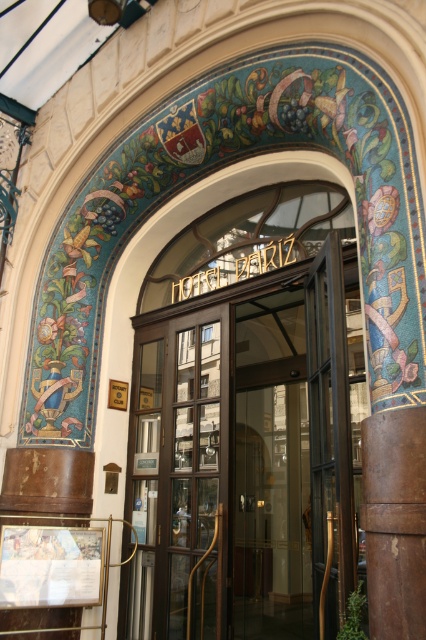
You are a hotel guest standing at the entrance of Hotel Bariz. You need to determine which object is taller between the polished brass door at center and the brown leather pillar at center. Which one is taller?

The polished brass door at center has a greater height compared to the brown leather pillar at center, so the polished brass door at center is taller.

You are a delivery person with a cart that is 5 feet wide. You need to move your cart through the entrance of Hotel Bariz. Can you fit your cart between the polished brass door at center and the brown leather pillar at center?

The distance between the polished brass door at center and the brown leather pillar at center is 6.15 feet. Since your cart is 5 feet wide, it can fit through the entrance as the space is wider than the cart.

You are standing at the entrance of Hotel Bariz and want to enter the building. There is a polished brass door at center and a brown leather pillar at center. Which object is closer to you as you approach the entrance?

The polished brass door at center is closer to you than the brown leather pillar at center because it is further to the viewer.